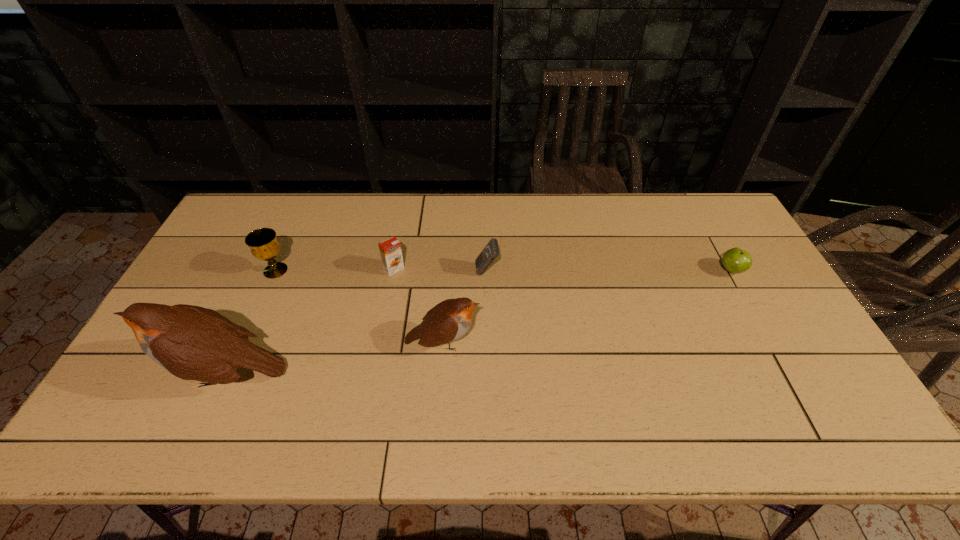
Locate an element on the screen. vacant area in the image that satisfies the following two spatial constraints: 1. on the front side of the chalice; 2. at the face of the left bird is located at coordinates (228, 374).